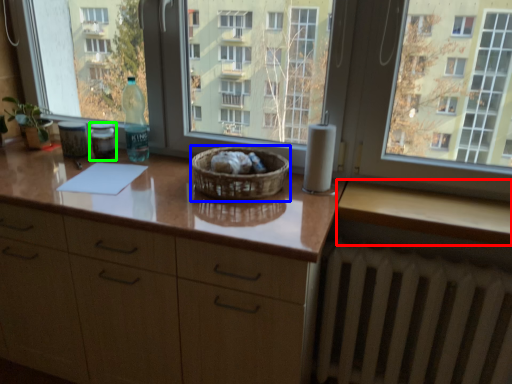
Question: Which object is positioned closest to counter top (highlighted by a red box)? Select from basket (highlighted by a blue box) and bottle (highlighted by a green box).

Choices:
 (A) basket
 (B) bottle

Answer: (A)